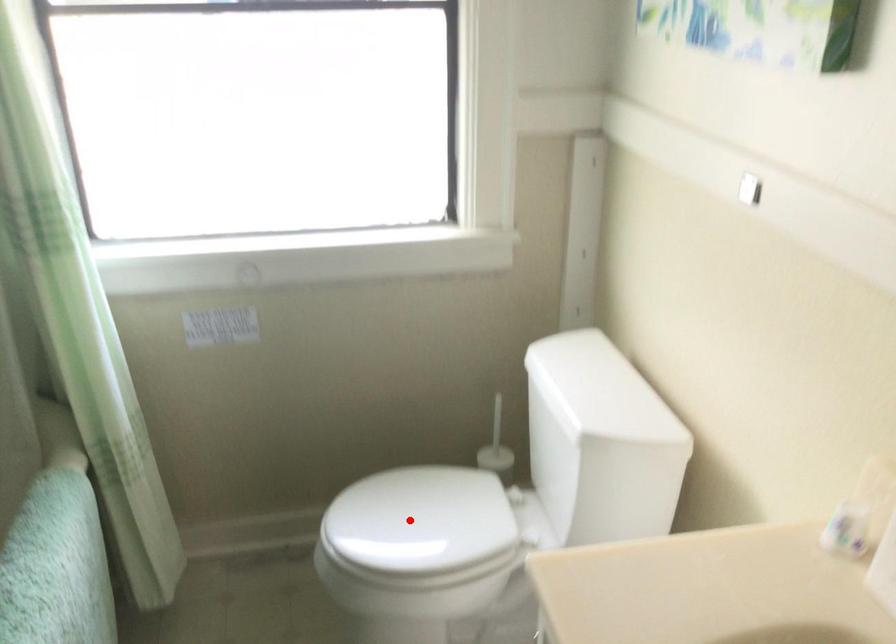
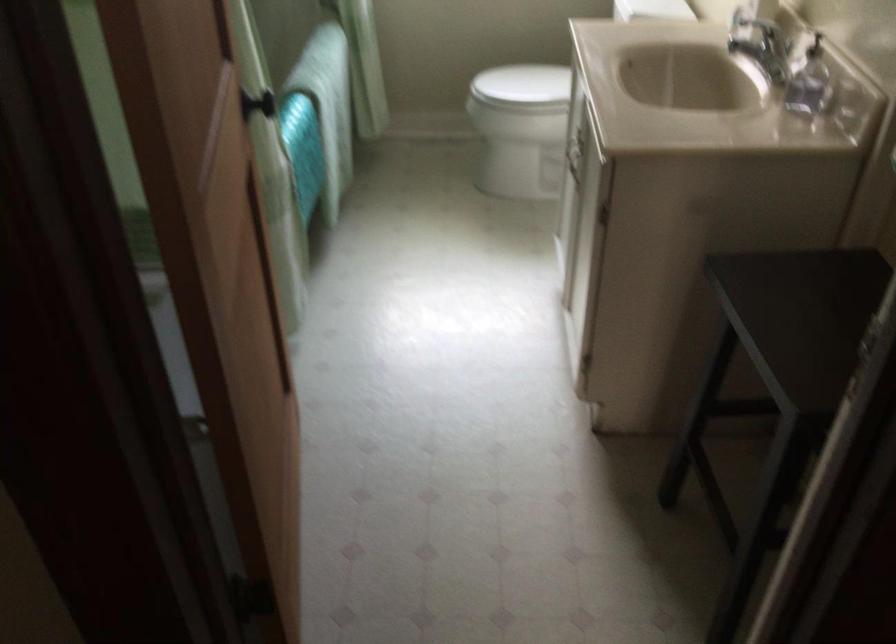
Question: I am providing you with two images of the same scene from different viewpoints. In image1, a red point is highlighted. Considering the same 3D point in image2, which of the following is correct?

Choices:
 (A) It is closer
 (B) It is farther

Answer: (B)